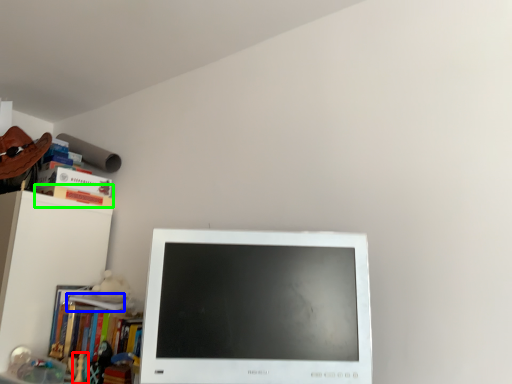
Question: Estimate the real-world distances between objects in this image. Which object is farther from toy (highlighted by a red box), book (highlighted by a blue box) or paperback book (highlighted by a green box)?

Choices:
 (A) book
 (B) paperback book

Answer: (B)